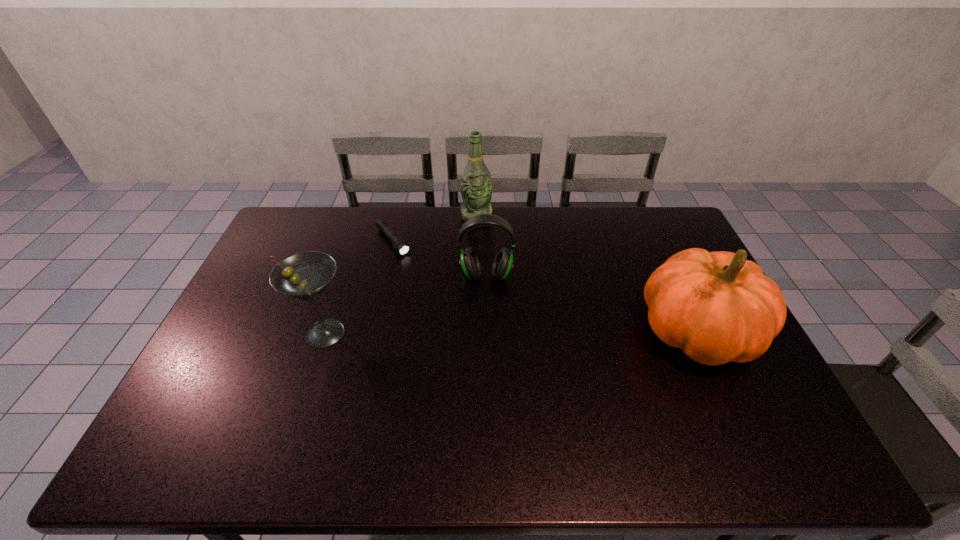
Locate an element on the screen. Image resolution: width=960 pixels, height=540 pixels. blank space at the far edge is located at coordinates (429, 230).

This screenshot has height=540, width=960. What are the coordinates of `vacant area at the near edge` in the screenshot? It's located at (246, 414).

Where is `vacant area at the left edge of the desktop`? This screenshot has height=540, width=960. vacant area at the left edge of the desktop is located at coordinates pyautogui.click(x=267, y=253).

Identify the location of free space at the right edge of the desktop. Image resolution: width=960 pixels, height=540 pixels. click(x=669, y=248).

Where is `free spot at the near left corner of the desktop`? free spot at the near left corner of the desktop is located at coordinates (178, 419).

Find the location of a particular element. The image size is (960, 540). vacant area that lies between the third nearest object and the beer bottle is located at coordinates (481, 246).

Where is `empty space that is in between the martini and the flashlight`? This screenshot has height=540, width=960. empty space that is in between the martini and the flashlight is located at coordinates (359, 287).

Where is `empty location between the third nearest object and the beer bottle`? empty location between the third nearest object and the beer bottle is located at coordinates (481, 246).

You are a GUI agent. You are given a task and a screenshot of the screen. Output one action in this format:
    pyautogui.click(x=<x>, y=<y>)
    Task: Click on the vacant area that lies between the flashlight and the martini
    Image resolution: width=960 pixels, height=540 pixels.
    Given the screenshot: What is the action you would take?
    pyautogui.click(x=359, y=287)

Where is `free space between the beer bottle and the martini`? Image resolution: width=960 pixels, height=540 pixels. free space between the beer bottle and the martini is located at coordinates (400, 275).